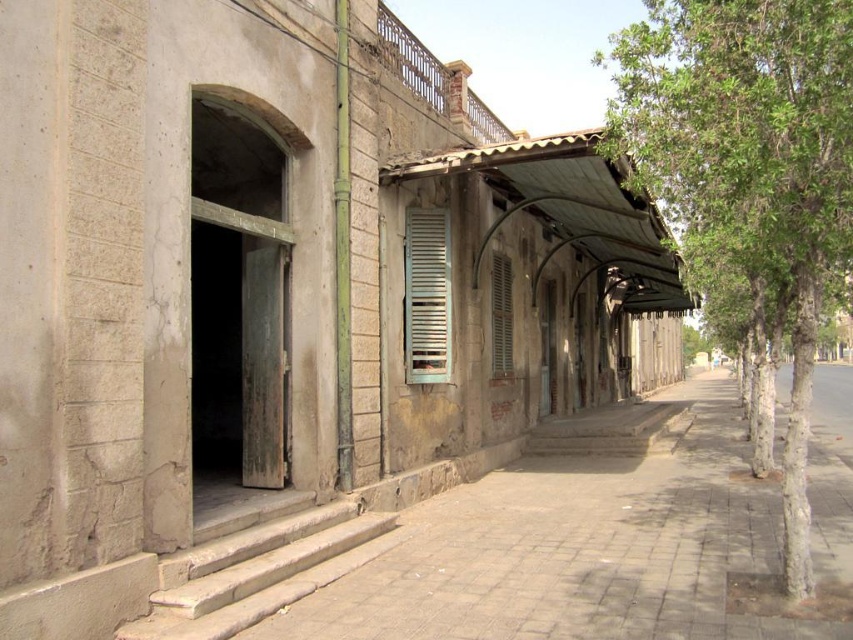
Question: Does brown brick pavement at center have a greater width compared to silver metallic shutter at center?

Choices:
 (A) no
 (B) yes

Answer: (B)

Question: Which of these objects is positioned closest to the white wooden shutter at center?

Choices:
 (A) green leafy tree at right
 (B) silver metallic shutter at center
 (C) brown brick pavement at center

Answer: (B)

Question: Is brown brick pavement at center further to camera compared to green leafy tree at right?

Choices:
 (A) no
 (B) yes

Answer: (B)

Question: Based on their relative distances, which object is farther from the brown brick pavement at center?

Choices:
 (A) silver metallic shutter at center
 (B) white wooden shutter at center

Answer: (A)

Question: Which point is farther from the camera taking this photo?

Choices:
 (A) tap(544, 563)
 (B) tap(430, 381)

Answer: (B)

Question: Can you confirm if silver metallic shutter at center is thinner than white wooden shutter at center?

Choices:
 (A) no
 (B) yes

Answer: (A)